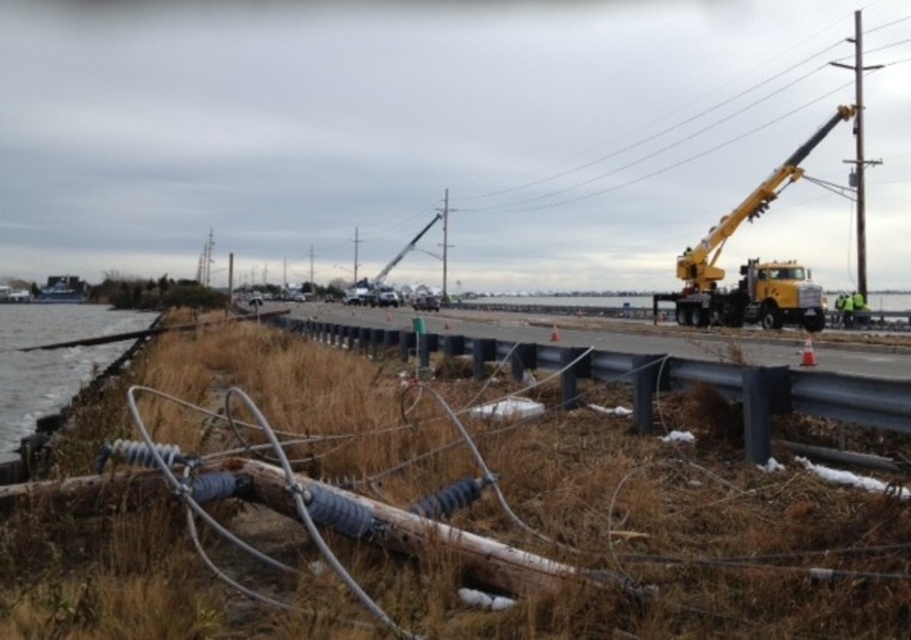
Can you confirm if yellow metallic crane at right is thinner than clear water at lower left?

Indeed, yellow metallic crane at right has a lesser width compared to clear water at lower left.

Is yellow metallic crane at right smaller than clear water at lower left?

Indeed, yellow metallic crane at right has a smaller size compared to clear water at lower left.

Does point (704, 253) come in front of point (94, 369)?

No, (704, 253) is further to viewer.

Where is `yellow metallic crane at right`? This screenshot has height=640, width=911. yellow metallic crane at right is located at coordinates (x=749, y=262).

Which is more to the left, black metal fence at center or metallic gray pole at center?

metallic gray pole at center is more to the left.

Between point (677, 364) and point (441, 289), which one is positioned behind?

The point (441, 289) is more distant.

This screenshot has width=911, height=640. What are the coordinates of `black metal fence at center` in the screenshot? It's located at (702, 381).

Can you confirm if metallic gray pole at upper right is thinner than yellow metallic crane at upper center?

No.

Describe the element at coordinates (858, 154) in the screenshot. The width and height of the screenshot is (911, 640). I see `metallic gray pole at upper right` at that location.

I want to click on metallic gray pole at upper right, so click(858, 154).